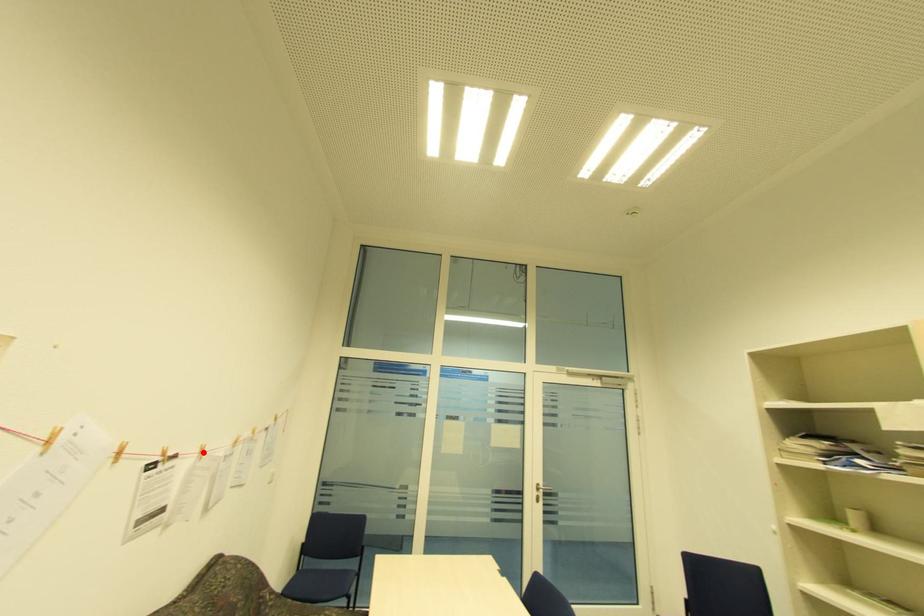
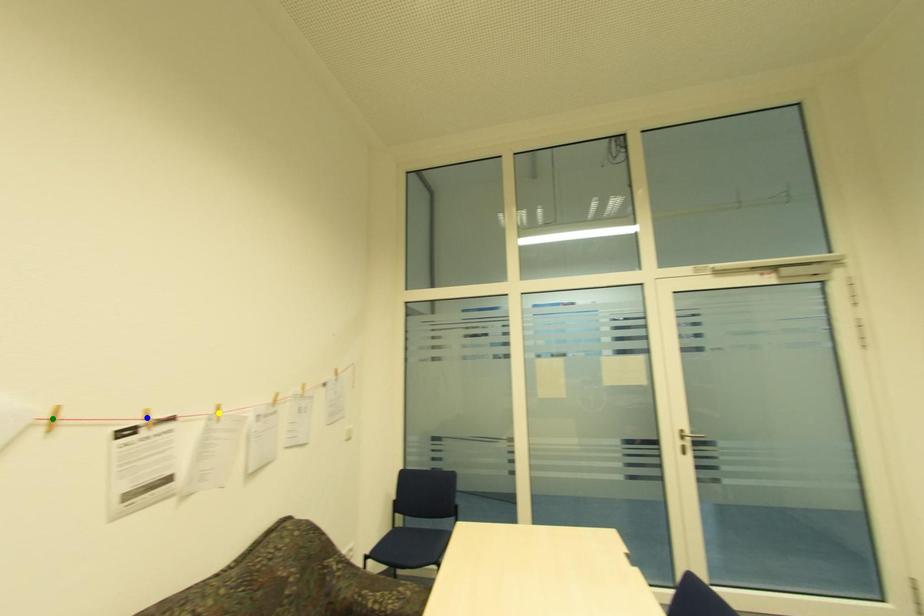
Question: I am providing you with two images of the same scene from different viewpoints. A red point is marked on the first image. You are given multiple points on the second image. In image 2, which mark is for the same physical point as the one in image 1?

Choices:
 (A) blue point
 (B) yellow point
 (C) green point

Answer: (B)